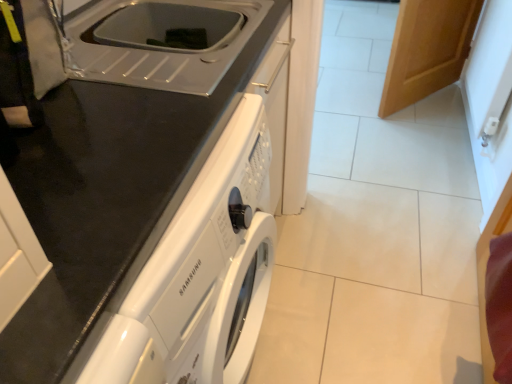
Question: Looking at the image, does white plastic sink at upper center seem bigger or smaller compared to wooden door at upper right?

Choices:
 (A) small
 (B) big

Answer: (A)

Question: Is point (65, 29) positioned closer to the camera than point (416, 92)?

Choices:
 (A) farther
 (B) closer

Answer: (B)

Question: Which of these objects is positioned farthest from the white glossy washing machine at center?

Choices:
 (A) wooden door at upper right
 (B) white plastic sink at upper center

Answer: (A)

Question: Which object is the closest to the white plastic sink at upper center?

Choices:
 (A) wooden door at upper right
 (B) white glossy washing machine at center

Answer: (B)